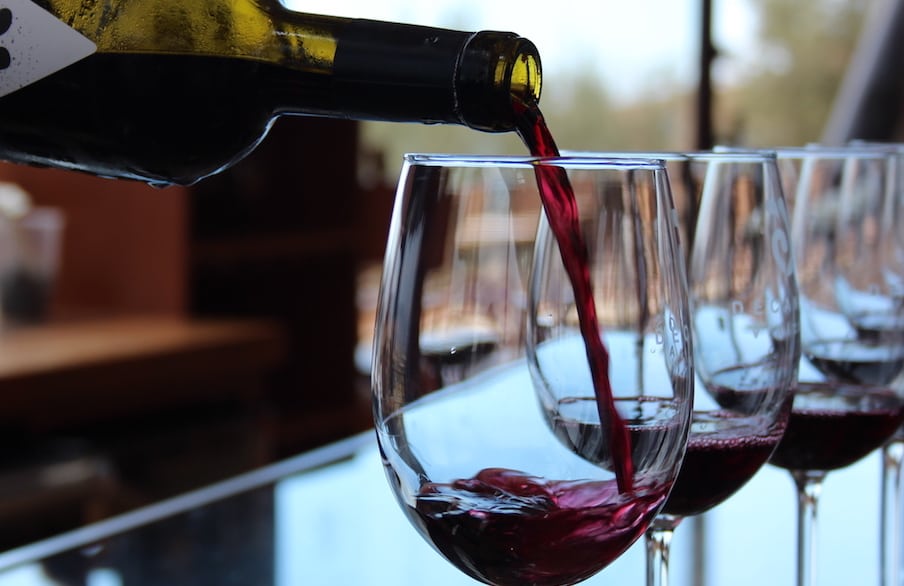
Find the location of a particular element. glasses of wine is located at coordinates (863, 141), (823, 143), (729, 146), (569, 151), (449, 160).